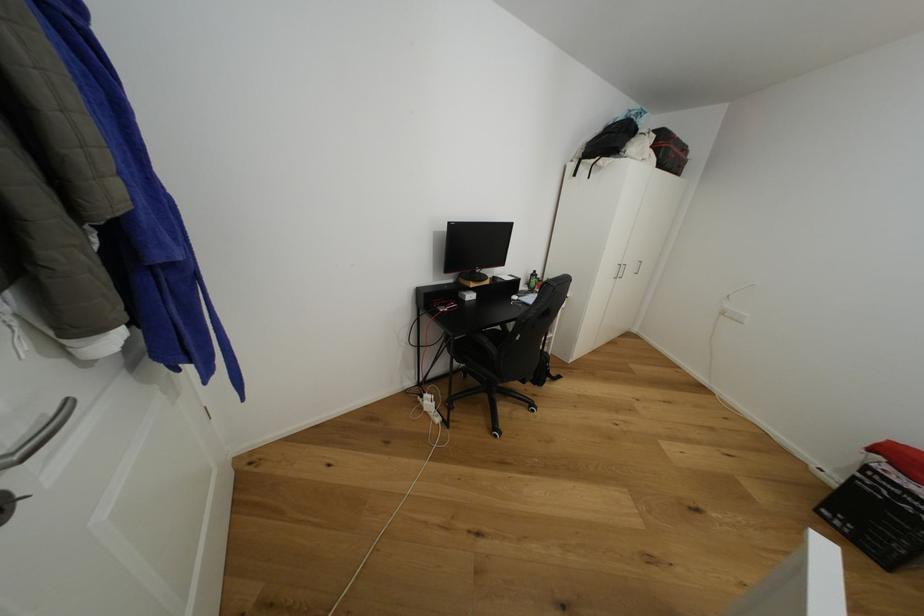
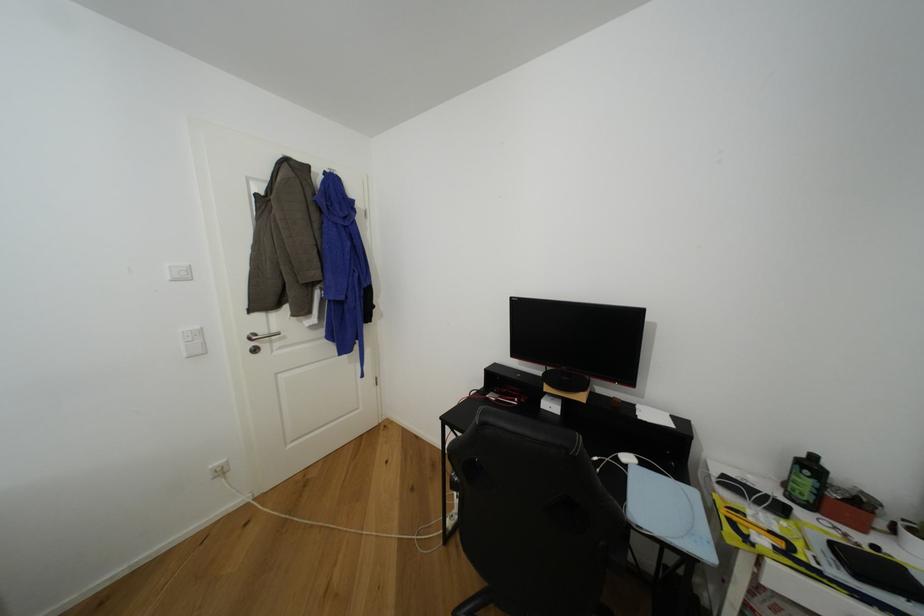
Locate, in the second image, the point that corresponds to (x=540, y=273) in the first image.

(820, 459)